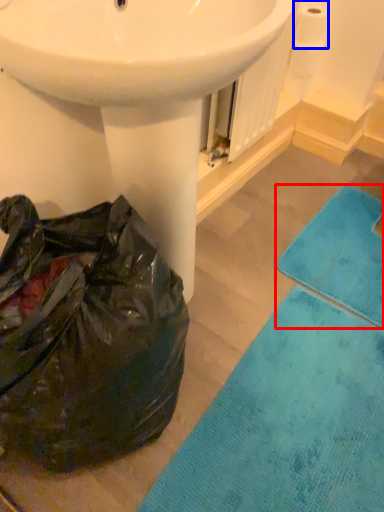
Question: Which object is further to the camera taking this photo, bath towel (highlighted by a red box) or toilet paper (highlighted by a blue box)?

Choices:
 (A) bath towel
 (B) toilet paper

Answer: (B)